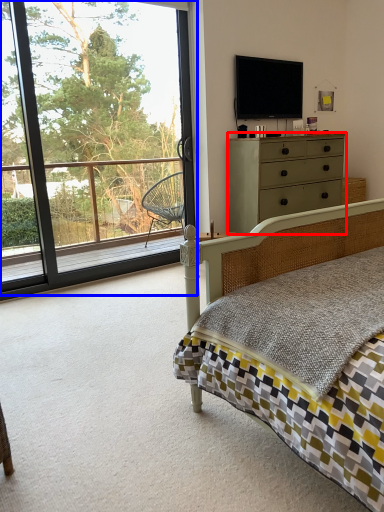
Question: Which object is further to the camera taking this photo, chest of drawers (highlighted by a red box) or window (highlighted by a blue box)?

Choices:
 (A) chest of drawers
 (B) window

Answer: (A)